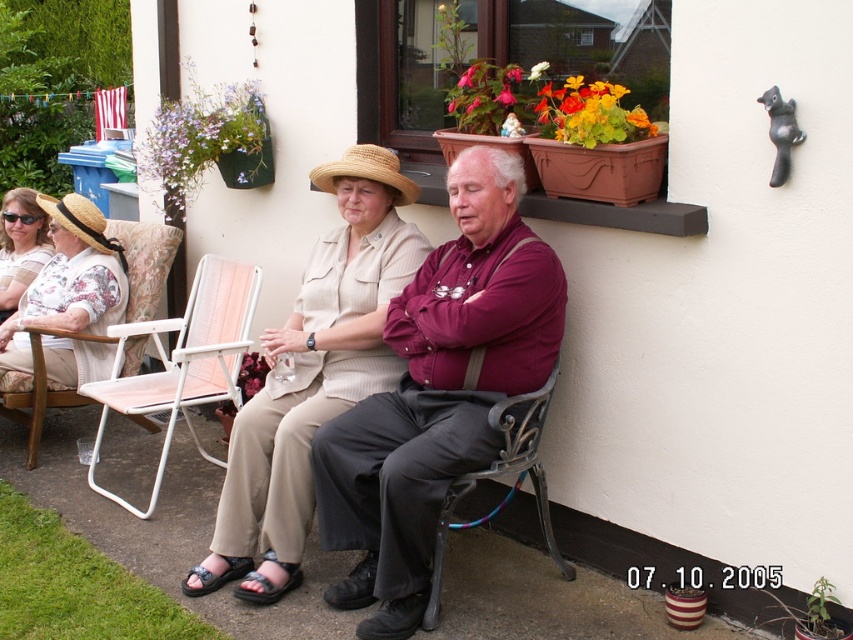
Which of these two, maroon shirt at center or strawhat at center, stands taller?

With more height is maroon shirt at center.

Which is in front, point (433, 486) or point (341, 154)?

Point (433, 486)

Identify the location of maroon shirt at center. (438, 392).

Does maroon shirt at center appear on the right side of beige textured blouse at center?

Correct, you'll find maroon shirt at center to the right of beige textured blouse at center.

Measure the distance from maroon shirt at center to beige textured blouse at center.

maroon shirt at center is 13.82 inches away from beige textured blouse at center.

At what (x,y) coordinates should I click in order to perform the action: click on maroon shirt at center. Please return your answer as a coordinate pair (x, y). This screenshot has width=853, height=640. Looking at the image, I should click on (438, 392).

Does floral fabric blouse at left have a smaller size compared to strawhat at center?

No.

Does floral fabric blouse at left appear on the left side of strawhat at center?

Correct, you'll find floral fabric blouse at left to the left of strawhat at center.

Does point (99, 353) lie behind point (384, 180)?

That is True.

Find the location of `floral fabric blouse at left`. floral fabric blouse at left is located at coordinates (68, 282).